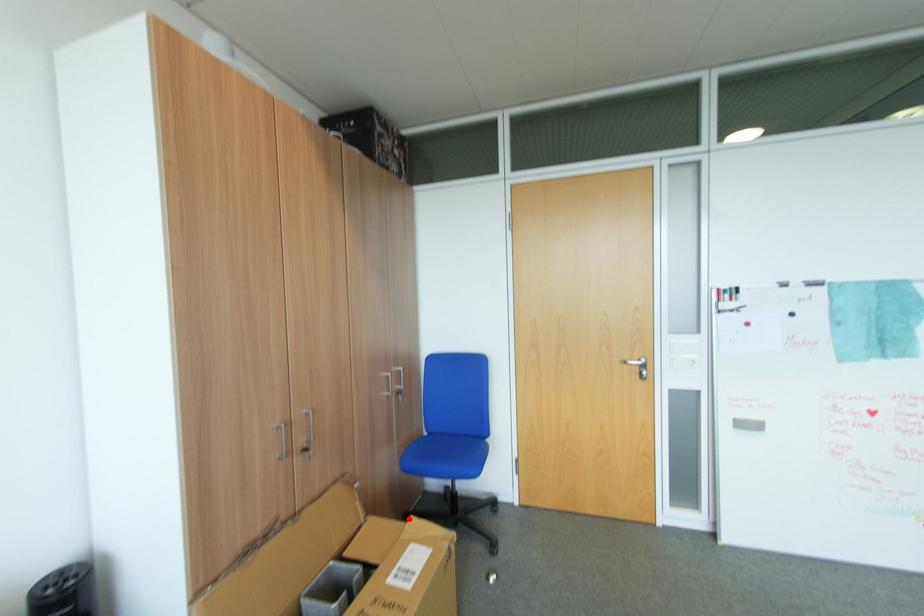
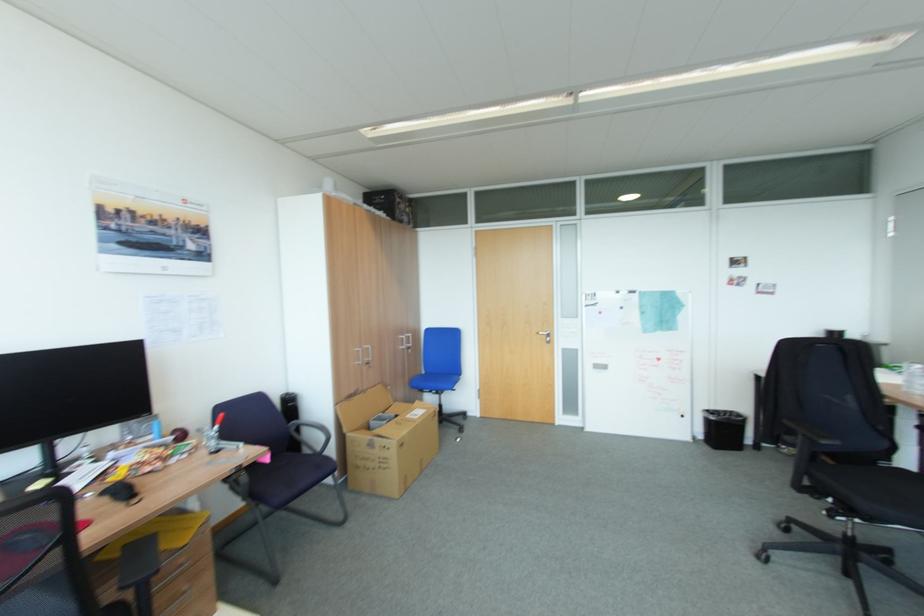
Question: A red point is marked in image1. In image2, is the corresponding 3D point closer to the camera or farther? Reply with the corresponding letter.

Choices:
 (A) The corresponding 3D point is closer.
 (B) The corresponding 3D point is farther.

Answer: (B)